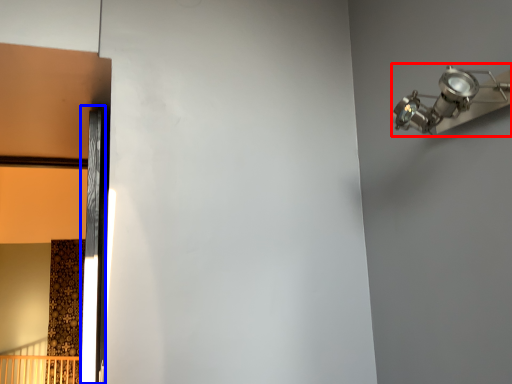
Question: Among these objects, which one is nearest to the camera, light fixture (highlighted by a red box) or door (highlighted by a blue box)?

Choices:
 (A) light fixture
 (B) door

Answer: (A)